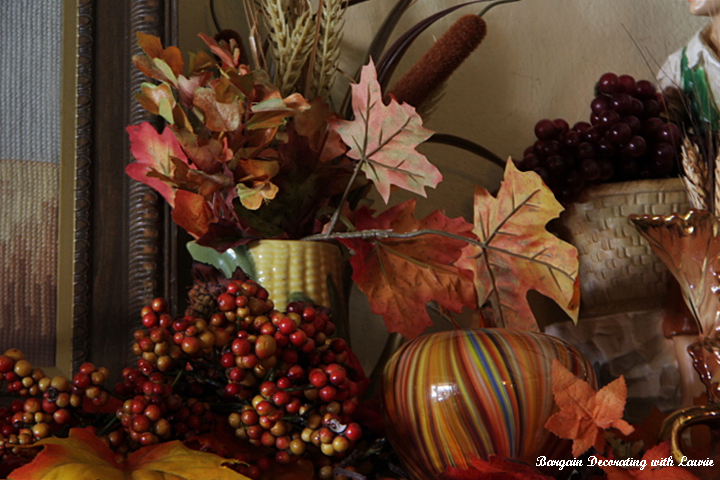
At what (x,y) coordinates should I click in order to perform the action: click on picture frame. Please return your answer as a coordinate pair (x, y). The width and height of the screenshot is (720, 480). Looking at the image, I should click on 109,48.